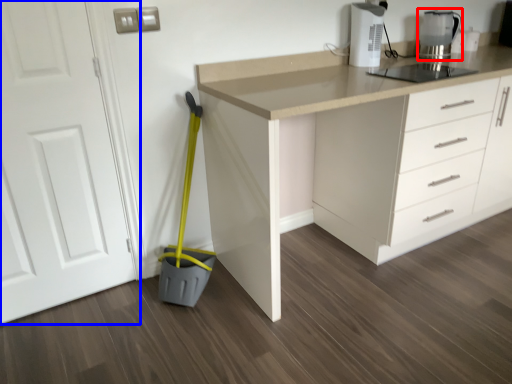
Question: Which of the following is the farthest to the observer, kitchen appliance (highlighted by a red box) or door (highlighted by a blue box)?

Choices:
 (A) kitchen appliance
 (B) door

Answer: (A)